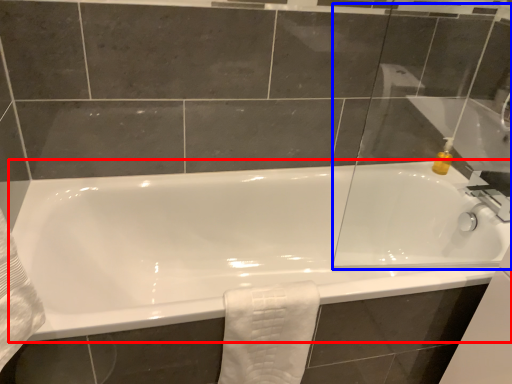
Question: Which point is further to the camera, bathtub (highlighted by a red box) or glass door (highlighted by a blue box)?

Choices:
 (A) bathtub
 (B) glass door

Answer: (A)